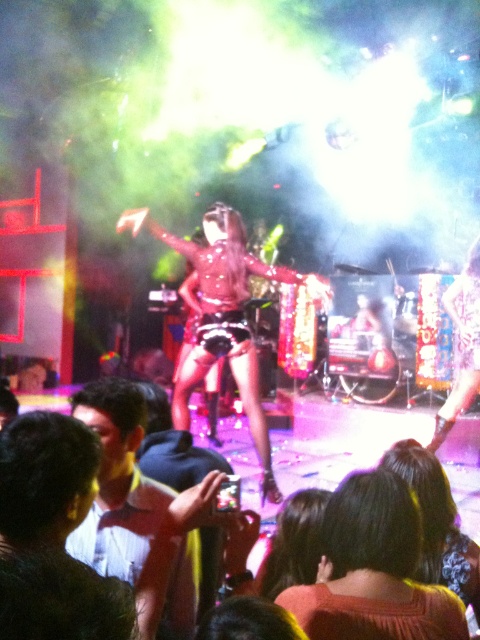
You are a photographer at the back of the stage. You want to capture both the point at (129, 500) and the point at (229, 330) in your shot. Which point should you focus on first to ensure both are in frame?

You should focus on point (129, 500) first because it is in front of point (229, 330), so capturing it first ensures both points are within the frame.

You are a photographer trying to capture a closeup of the brown textured sweater at lower center and the white glossy shirt at lower left. Can you fit both items in the frame if your camera has a 12 inch wide lens?

The brown textured sweater at lower center and white glossy shirt at lower left are 14.34 inches apart, so no, the camera lens is not wide enough to capture both items in the frame since the distance between them exceeds the lens width.

You are a photographer at the back of the stage and want to take a photo of the shiny metallic outfit at center and the brown textured sweater at lower center. Which object should you focus on first if you want to capture both in the same frame without moving the camera?

You should focus on the shiny metallic outfit at center first because the brown textured sweater at lower center is positioned to its right side, so adjusting focus to the center ensures both are in frame.